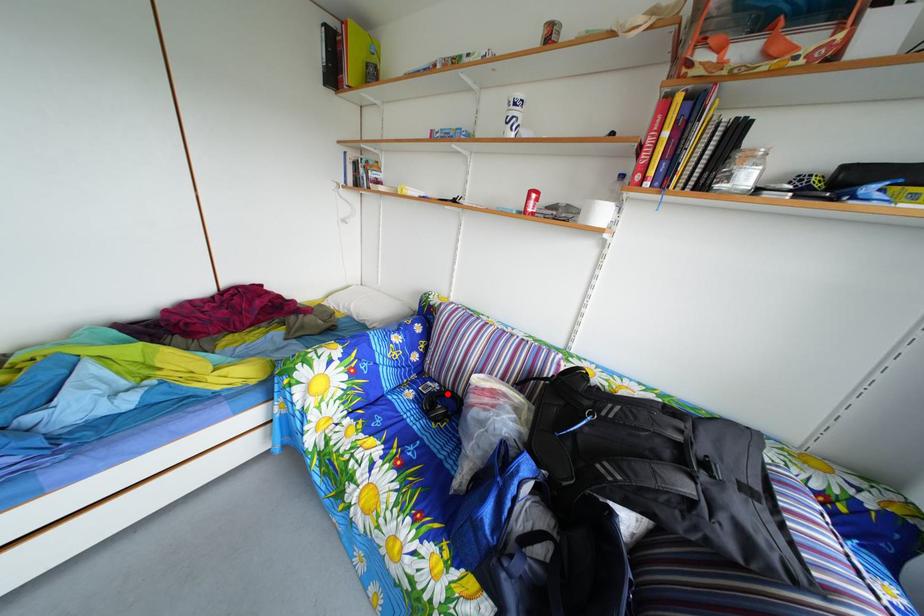
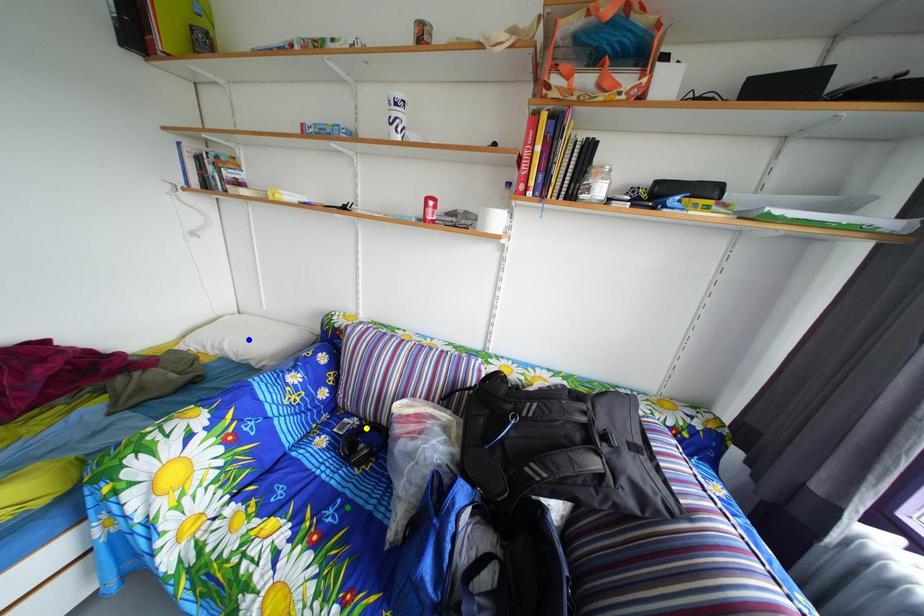
Question: I am providing you with two images of the same scene from different viewpoints. A red point is marked on the first image. You are given multiple points on the second image. Can you choose the point in image 2 that corresponds to the point in image 1?

Choices:
 (A) green point
 (B) yellow point
 (C) blue point

Answer: (B)